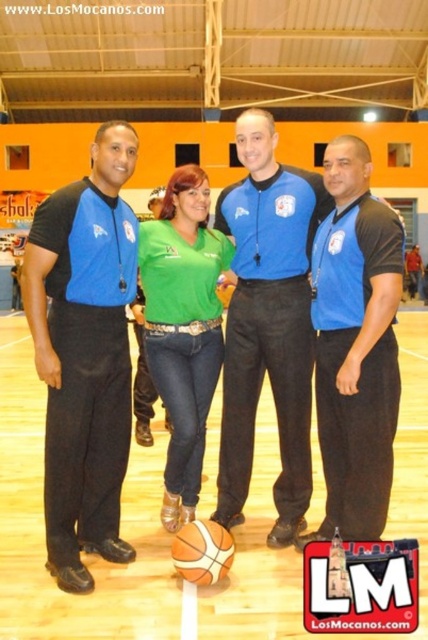
What do you see at coordinates (356, 346) in the screenshot?
I see `blue fabric shirt at center` at bounding box center [356, 346].

Who is taller, blue fabric shirt at center or green matte shirt at center?

green matte shirt at center is taller.

Where is `blue fabric shirt at center`? This screenshot has height=640, width=428. blue fabric shirt at center is located at coordinates (356, 346).

What are the coordinates of `blue fabric shirt at center` in the screenshot? It's located at (356, 346).

Does matte blue shirt at left have a smaller size compared to blue fabric shirt at center?

No.

Between point (134, 138) and point (357, 140), which one is positioned in front?

Point (357, 140) is more forward.

The image size is (428, 640). What are the coordinates of `matte blue shirt at left` in the screenshot? It's located at (85, 353).

Between matte blue shirts at center and matte blue shirt at left, which one appears on the left side from the viewer's perspective?

From the viewer's perspective, matte blue shirt at left appears more on the left side.

How much distance is there between matte blue shirts at center and matte blue shirt at left?

matte blue shirts at center and matte blue shirt at left are 1.17 inches apart from each other.

Describe the element at coordinates (83, 353) in the screenshot. The height and width of the screenshot is (640, 428). I see `matte blue shirts at center` at that location.

Image resolution: width=428 pixels, height=640 pixels. I want to click on matte blue shirts at center, so click(83, 353).